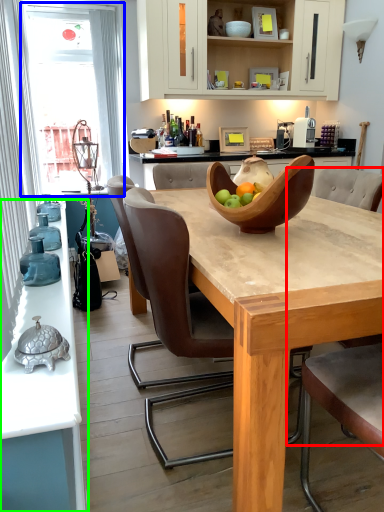
Question: Considering the real-world distances, which object is farthest from armchair (highlighted by a red box)? window screen (highlighted by a blue box) or countertop (highlighted by a green box)?

Choices:
 (A) window screen
 (B) countertop

Answer: (A)